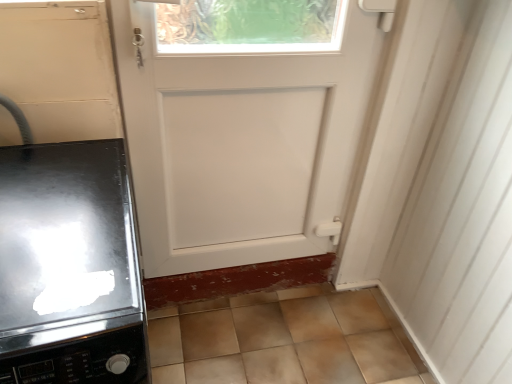
Question: Is white matte door at center taller or shorter than glossy black stove at left?

Choices:
 (A) tall
 (B) short

Answer: (A)

Question: Considering the positions of white matte door at center and glossy black stove at left in the image, is white matte door at center wider or thinner than glossy black stove at left?

Choices:
 (A) wide
 (B) thin

Answer: (B)

Question: Would you say white matte door at center is to the left or to the right of glossy black stove at left in the picture?

Choices:
 (A) right
 (B) left

Answer: (A)

Question: Visually, is glossy black stove at left positioned to the left or to the right of white matte door at center?

Choices:
 (A) left
 (B) right

Answer: (A)

Question: From a real-world perspective, is glossy black stove at left positioned above or below white matte door at center?

Choices:
 (A) below
 (B) above

Answer: (A)

Question: Is point (45, 327) positioned closer to the camera than point (180, 57)?

Choices:
 (A) farther
 (B) closer

Answer: (B)

Question: Which is correct: glossy black stove at left is inside white matte door at center, or outside of it?

Choices:
 (A) outside
 (B) inside

Answer: (A)